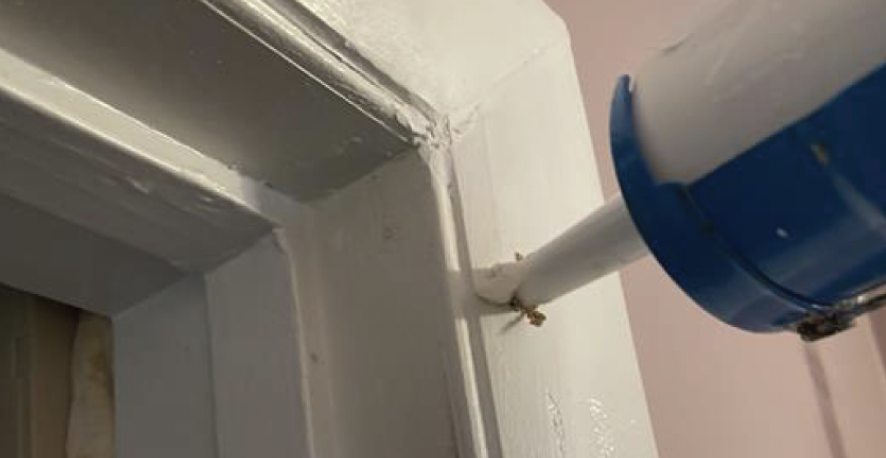
The height and width of the screenshot is (458, 886). What are the coordinates of `caulk` in the screenshot? It's located at (494, 291).